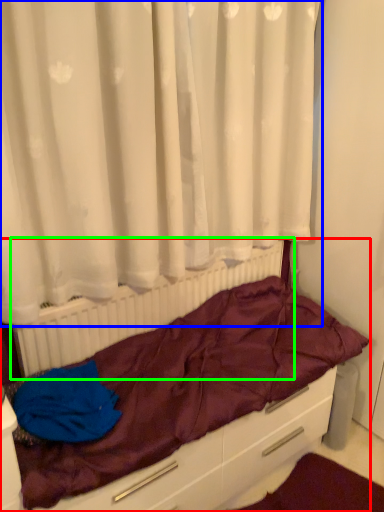
Question: Which object is the farthest from furniture (highlighted by a red box)? Choose among these: curtain (highlighted by a blue box) or radiator (highlighted by a green box).

Choices:
 (A) curtain
 (B) radiator

Answer: (A)